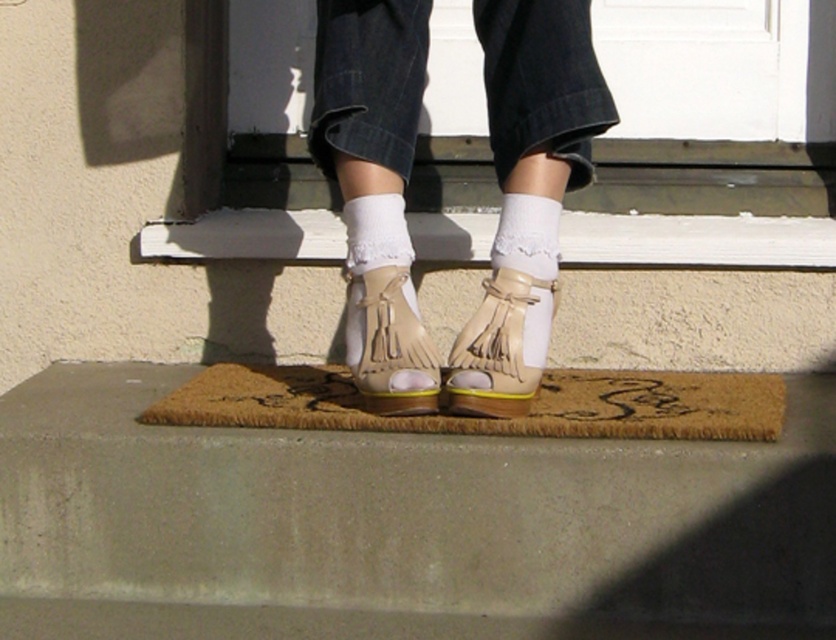
You are designing a virtual reality scene and need to place a virtual object exactly where the beige suede fringe sandal at center is located. What are the 2D coordinates you should use?

The 2D coordinates for the beige suede fringe sandal at center are at point (497, 348). Use these coordinates to place the virtual object.

You are standing on the brown coir mat at center and want to step onto the beige suede sandals at center. Is the sandals closer to you than the mat?

The beige suede sandals at center is further to the viewer than brown coir mat at center, so the sandals are not closer to you than the mat. The mat is closer to you.